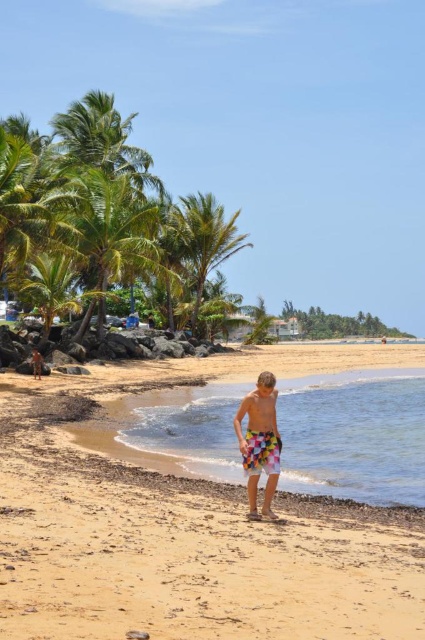
Can you confirm if smooth golden sand at center is positioned to the right of colorful fabric shorts at center?

Incorrect, smooth golden sand at center is not on the right side of colorful fabric shorts at center.

The height and width of the screenshot is (640, 425). Find the location of `smooth golden sand at center`. smooth golden sand at center is located at coordinates (187, 552).

This screenshot has width=425, height=640. Find the location of `smooth golden sand at center`. smooth golden sand at center is located at coordinates (187, 552).

Where is `smooth golden sand at center`? smooth golden sand at center is located at coordinates (187, 552).

Between clear water at lower center and colorful fabric shorts at center, which one has less height?

With less height is clear water at lower center.

Does point (424, 445) come behind point (272, 392)?

Yes.

Locate an element on the screen. clear water at lower center is located at coordinates (354, 435).

This screenshot has width=425, height=640. In order to click on clear water at lower center in this screenshot , I will do `click(354, 435)`.

Does multicolored fabric shorts at center appear on the right side of colorful fabric shorts at center?

In fact, multicolored fabric shorts at center is to the left of colorful fabric shorts at center.

Who is more forward, (274, 392) or (249, 403)?

Point (249, 403) is more forward.

I want to click on multicolored fabric shorts at center, so click(260, 442).